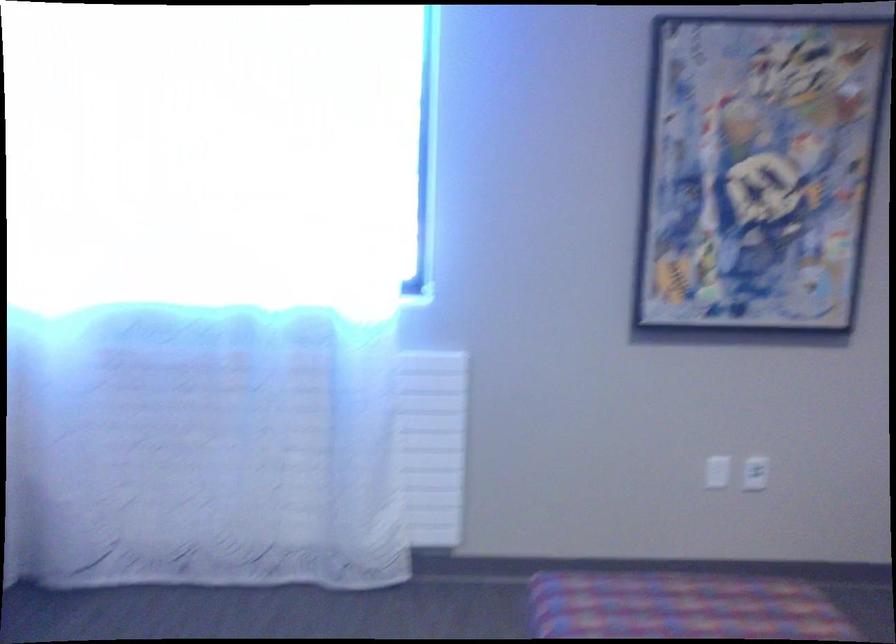
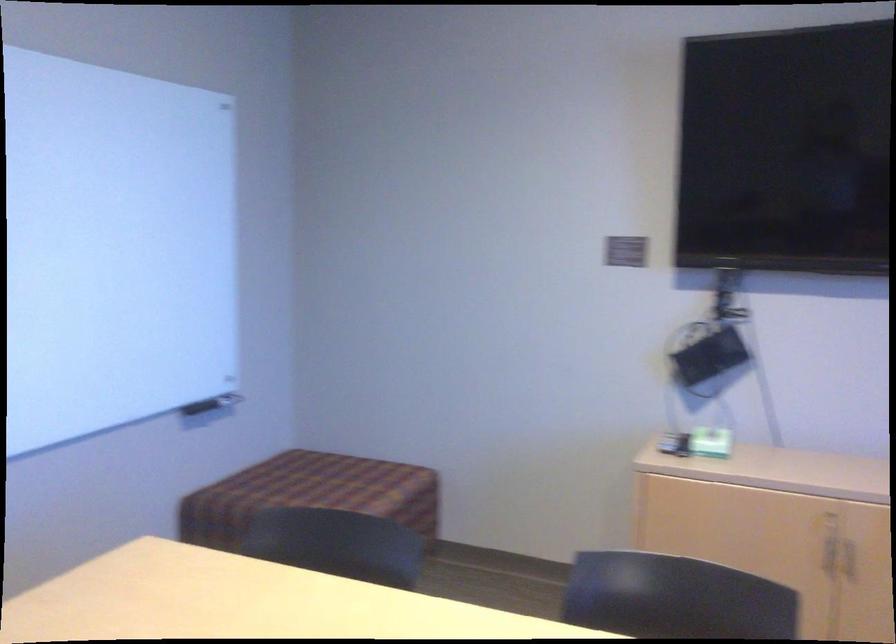
Question: The images are taken continuously from a first-person perspective. In which direction is your viewpoint rotating?

Choices:
 (A) Left
 (B) Right
 (C) Up
 (D) Down

Answer: (A)